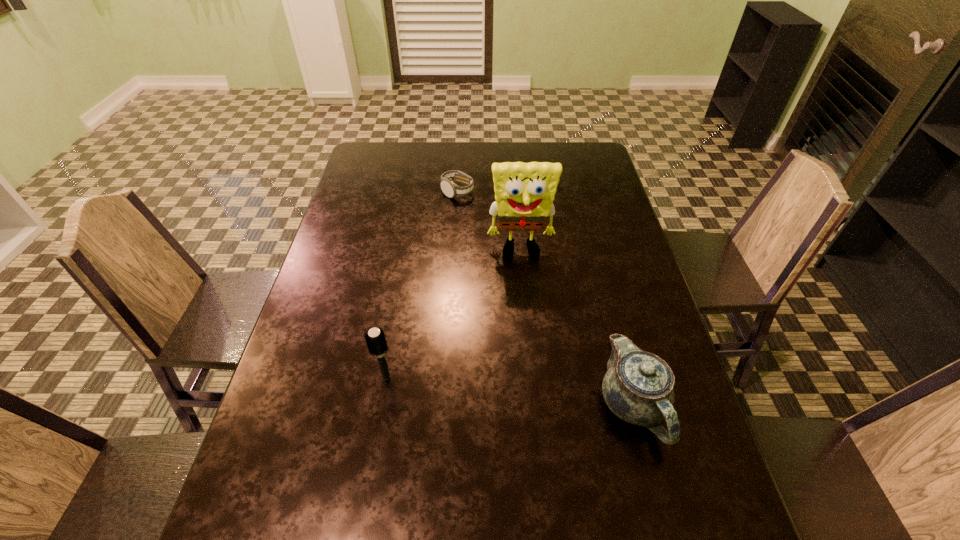
Find the location of a particular element. This screenshot has height=540, width=960. free area in between the second object from right to left and the second shortest object is located at coordinates 577,328.

Find the location of a particular element. object that is the third closest one to the tallest object is located at coordinates (375, 338).

Locate an element on the screen. Image resolution: width=960 pixels, height=540 pixels. the closest object to the leftmost object is located at coordinates (524, 192).